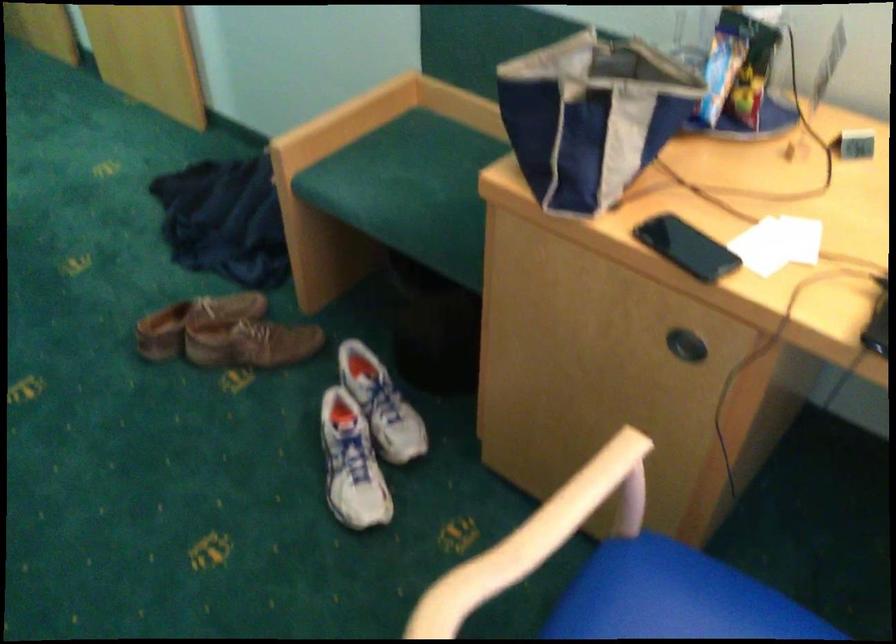
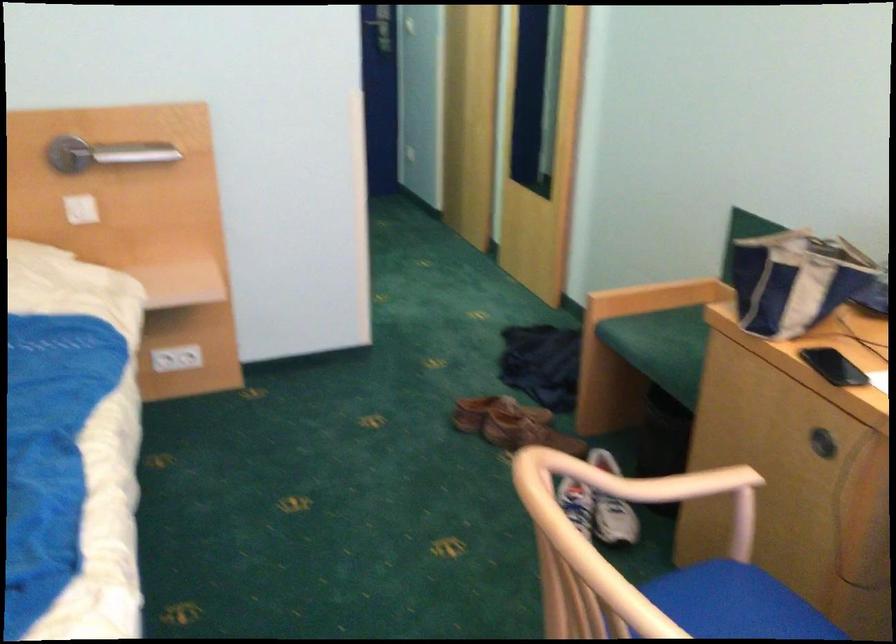
In the second image, find the point that corresponds to (x=392, y=207) in the first image.

(661, 346)